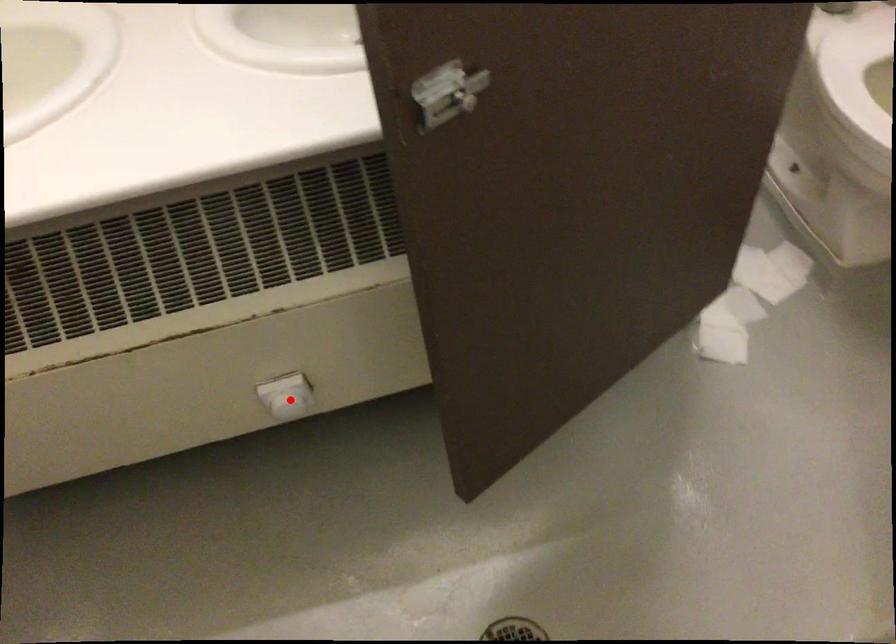
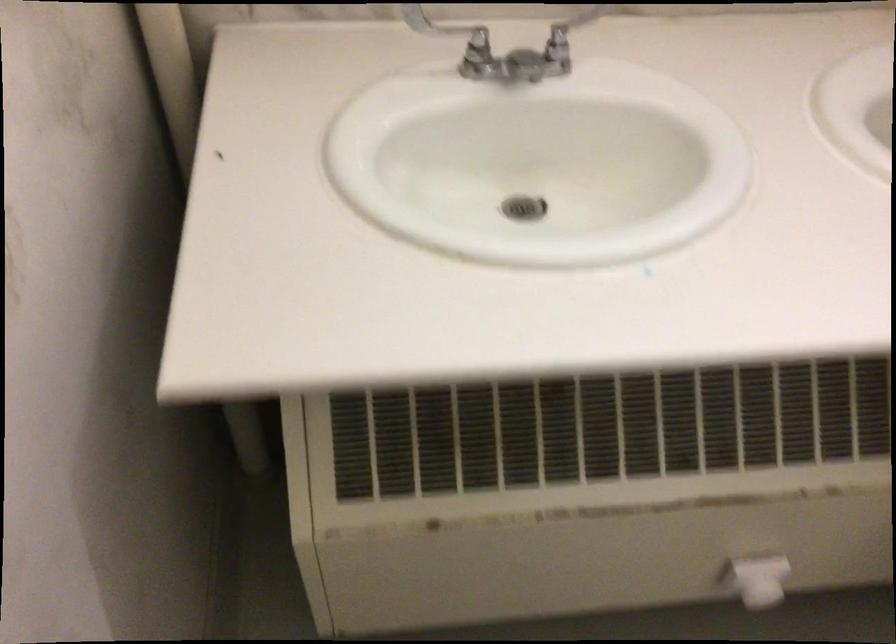
Find the pixel in the second image that matches the highlighted location in the first image.

(759, 580)